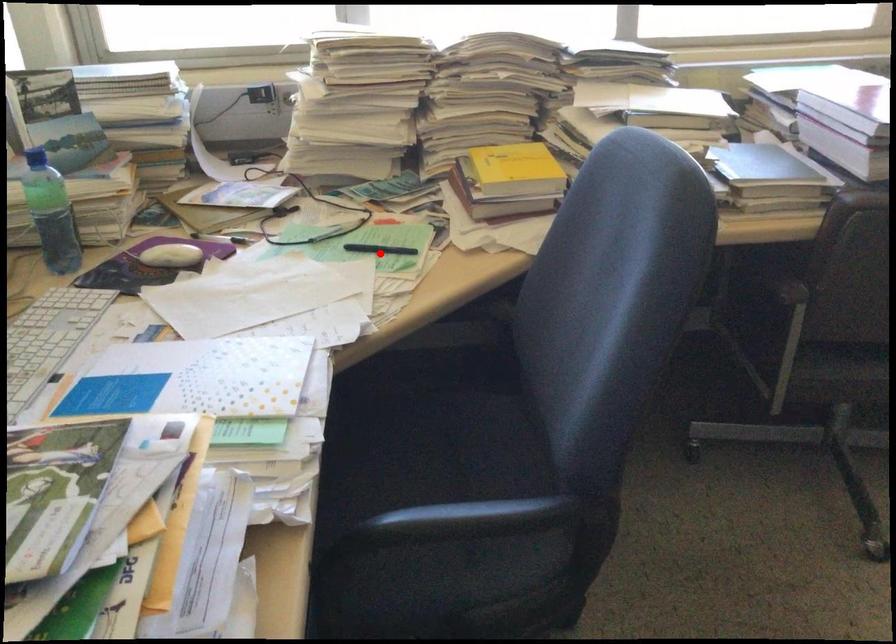
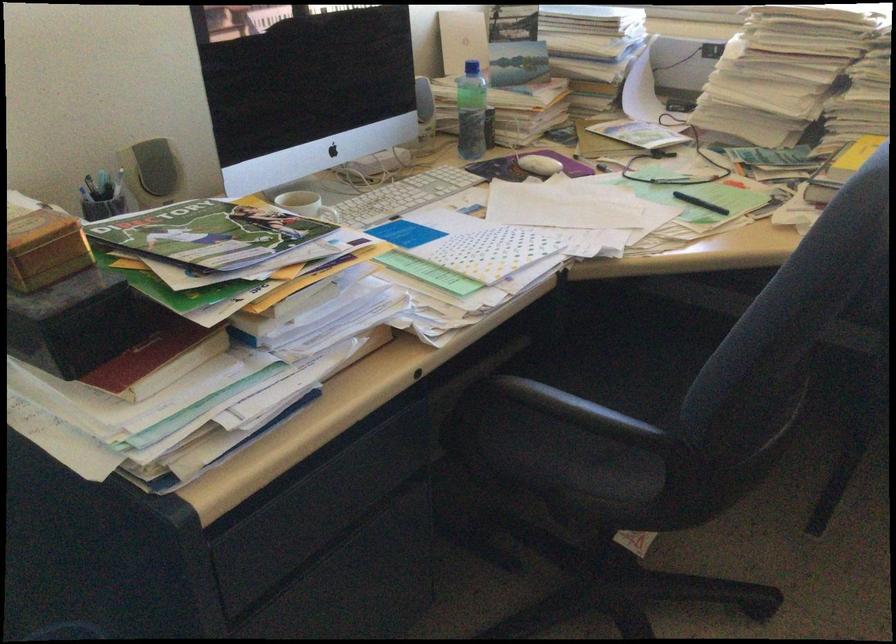
In the second image, find the point that corresponds to the highlighted location in the first image.

(700, 203)